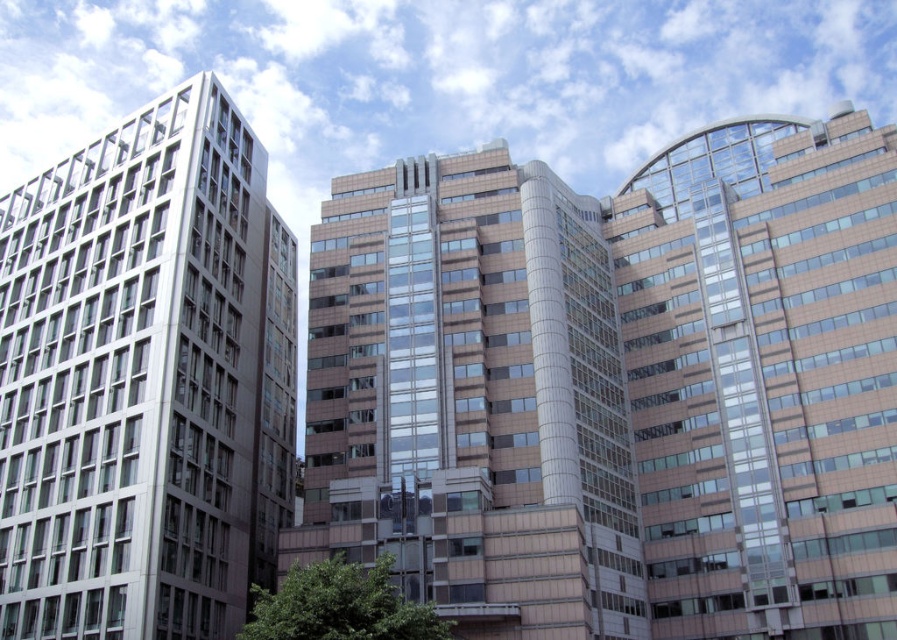
You are an architect analyzing the skyline. Given that the metallic glass building at left and the matte glass building at right are part of a new urban development, which building would you recommend for installing rooftop solar panels to maximize energy efficiency, considering their heights?

The matte glass building at right is taller than the metallic glass building at left, so installing rooftop solar panels on the matte glass building at right would likely maximize energy efficiency as taller buildings typically have larger roof areas and better exposure to sunlight.

You are an architect analyzing the layout of the buildings in the image. Which building has a greater width between the metallic glass building at left and the matte glass building at right?

The metallic glass building at left has a greater width than the matte glass building at right according to the description.

You are an architect reviewing a cityscape design. You notice the metallic glass building at left and the matte glass building at right. Based on their sizes, which building would require more materials for its construction?

The metallic glass building at left requires more materials for its construction because it has a larger size compared to the matte glass building at right.